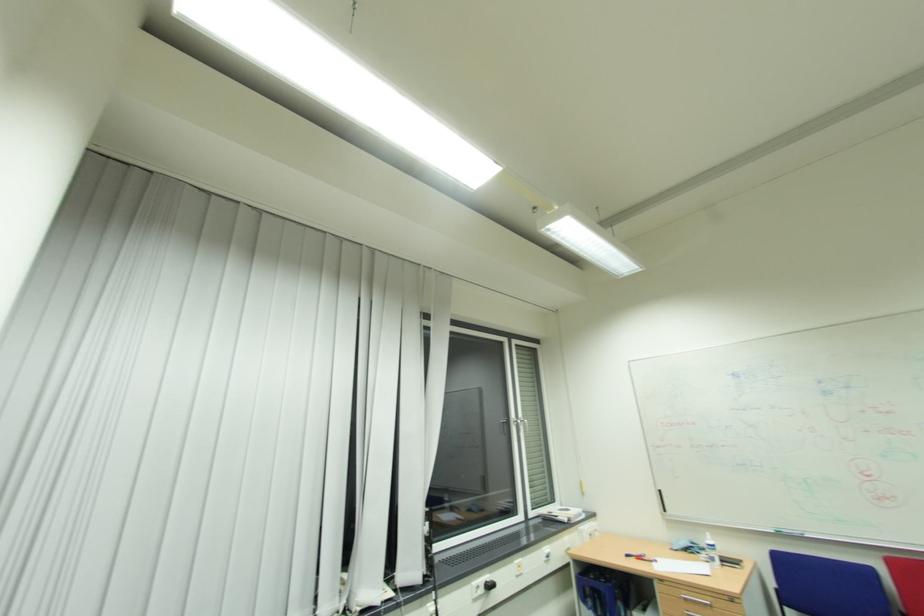
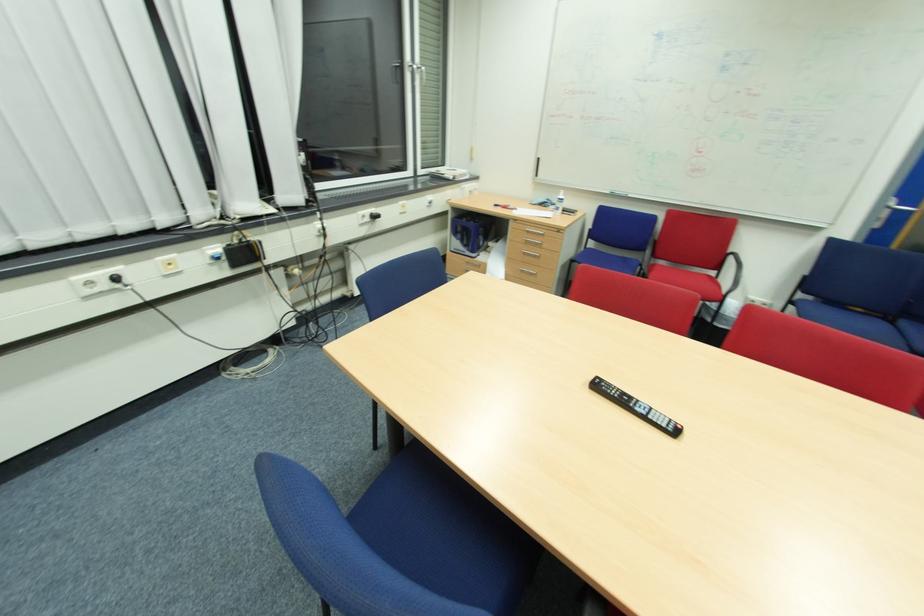
The point at (527, 427) is marked in the first image. Where is the corresponding point in the second image?

(427, 78)